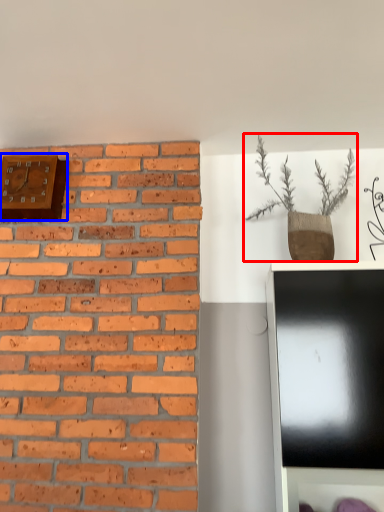
Question: Which of the following is the farthest to the observer, houseplant (highlighted by a red box) or clock (highlighted by a blue box)?

Choices:
 (A) houseplant
 (B) clock

Answer: (B)